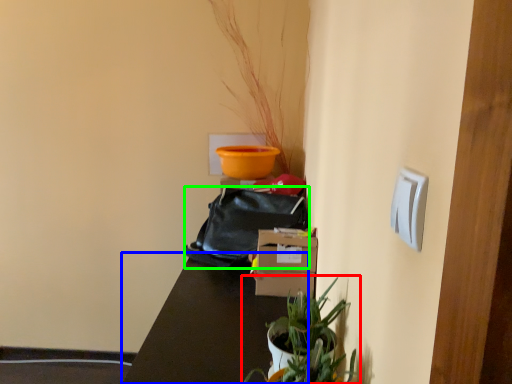
Question: Estimate the real-world distances between objects in this image. Which object is closer to houseplant (highlighted by a red box), table (highlighted by a blue box) or bag (highlighted by a green box)?

Choices:
 (A) table
 (B) bag

Answer: (A)